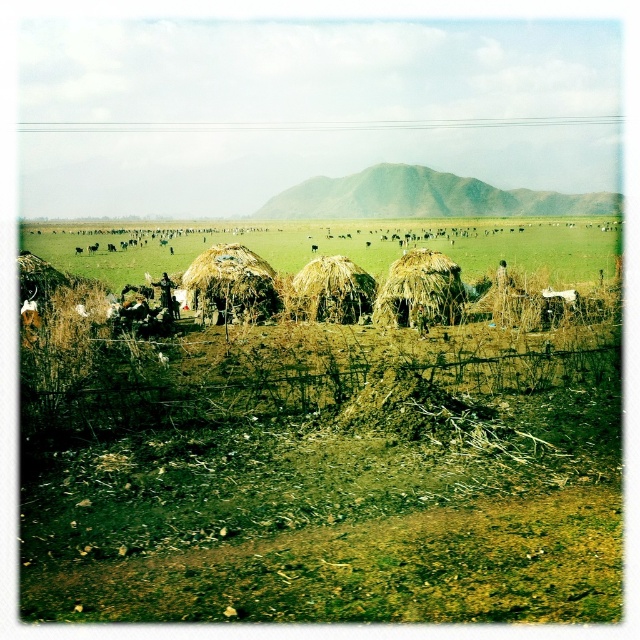
Question: Which point appears closest to the camera in this image?

Choices:
 (A) (116, 276)
 (B) (246, 307)

Answer: (B)

Question: Is brown straw huts at center further to the viewer compared to brown thatch hut at center?

Choices:
 (A) no
 (B) yes

Answer: (B)

Question: Considering the relative positions of brown straw huts at center and brown thatch hut at center in the image provided, where is brown straw huts at center located with respect to brown thatch hut at center?

Choices:
 (A) left
 (B) right

Answer: (A)

Question: Is brown straw huts at center smaller than brown thatch hut at center?

Choices:
 (A) no
 (B) yes

Answer: (A)

Question: Which point is farther from the camera taking this photo?

Choices:
 (A) (253, 253)
 (B) (56, 241)

Answer: (B)